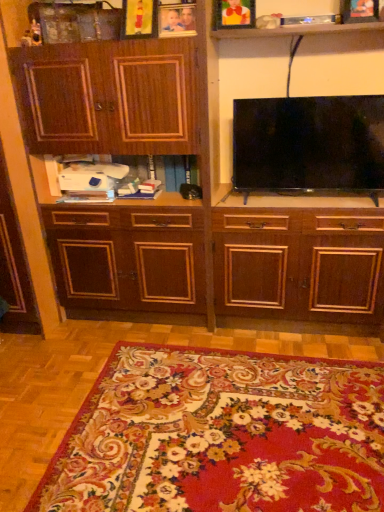
Question: In which direction should I rotate to look at wooden photo frame at upper center, marked as the second picture frame in a left-to-right arrangement?

Choices:
 (A) left
 (B) right

Answer: (A)

Question: Is dark wood cabinet at center facing away from wooden picture frame at upper center, positioned as the 4th picture frame in right-to-left order?

Choices:
 (A) yes
 (B) no

Answer: (A)

Question: Does dark wood cabinet at center have a greater width compared to wooden picture frame at upper center, which is the 1th picture frame in left-to-right order?

Choices:
 (A) yes
 (B) no

Answer: (A)

Question: Is dark wood cabinet at center at the right side of wooden picture frame at upper center, which is the 1th picture frame in left-to-right order?

Choices:
 (A) yes
 (B) no

Answer: (A)

Question: Can you confirm if dark wood cabinet at center is taller than wooden picture frame at upper center, positioned as the 4th picture frame in right-to-left order?

Choices:
 (A) yes
 (B) no

Answer: (A)

Question: From the image's perspective, is dark wood cabinet at center below wooden picture frame at upper center, which is the 1th picture frame in left-to-right order?

Choices:
 (A) yes
 (B) no

Answer: (A)

Question: Does dark wood cabinet at center touch wooden picture frame at upper center, positioned as the 4th picture frame in right-to-left order?

Choices:
 (A) yes
 (B) no

Answer: (B)

Question: Are black glossy flat-screen tv at upper center and wooden picture frame at upper right, positioned as the fourth picture frame in left-to-right order, located far from each other?

Choices:
 (A) yes
 (B) no

Answer: (B)

Question: Does black glossy flat-screen tv at upper center have a lesser width compared to wooden picture frame at upper right, the 1th picture frame positioned from the right?

Choices:
 (A) no
 (B) yes

Answer: (A)

Question: Is black glossy flat-screen tv at upper center positioned behind wooden picture frame at upper right, the 1th picture frame positioned from the right?

Choices:
 (A) yes
 (B) no

Answer: (A)

Question: Is black glossy flat-screen tv at upper center smaller than wooden picture frame at upper right, the 1th picture frame positioned from the right?

Choices:
 (A) yes
 (B) no

Answer: (B)

Question: From a real-world perspective, is black glossy flat-screen tv at upper center positioned over wooden picture frame at upper right, positioned as the fourth picture frame in left-to-right order, based on gravity?

Choices:
 (A) yes
 (B) no

Answer: (B)

Question: Would you say black glossy flat-screen tv at upper center is outside wooden picture frame at upper right, the 1th picture frame positioned from the right?

Choices:
 (A) no
 (B) yes

Answer: (B)

Question: Considering the relative sizes of wooden picture frame at upper center, which appears as the 3th picture frame when viewed from the left, and black glossy flat-screen tv at upper center in the image provided, is wooden picture frame at upper center, which appears as the 3th picture frame when viewed from the left, taller than black glossy flat-screen tv at upper center?

Choices:
 (A) yes
 (B) no

Answer: (B)